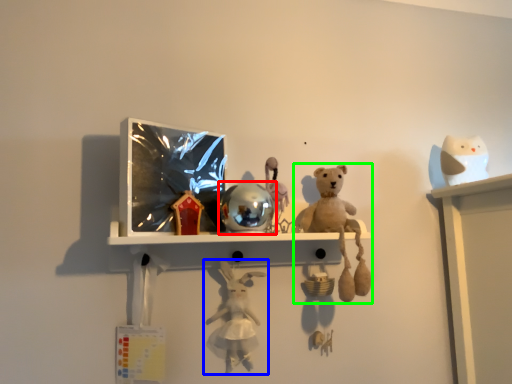
Question: Which is nearer to the toy (highlighted by a red box)? toy (highlighted by a blue box) or toy (highlighted by a green box).

Choices:
 (A) toy
 (B) toy

Answer: (B)